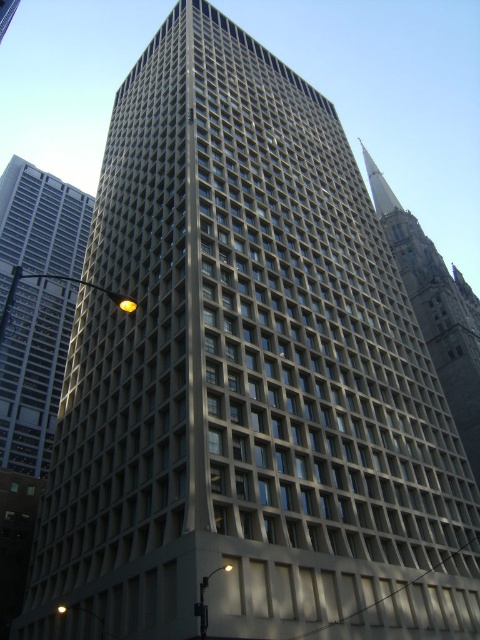
Question: Is silver glass skyscraper at left closer to the viewer compared to smooth gray tower at upper right?

Choices:
 (A) no
 (B) yes

Answer: (A)

Question: Which object is closer to the camera taking this photo?

Choices:
 (A) silver glass skyscraper at left
 (B) smooth gray tower at upper right

Answer: (B)

Question: Which object is farther from the camera taking this photo?

Choices:
 (A) silver glass skyscraper at left
 (B) smooth gray tower at upper right

Answer: (A)

Question: Is silver glass skyscraper at left smaller than smooth gray tower at upper right?

Choices:
 (A) no
 (B) yes

Answer: (B)

Question: Is silver glass skyscraper at left to the left of smooth gray tower at upper right from the viewer's perspective?

Choices:
 (A) no
 (B) yes

Answer: (B)